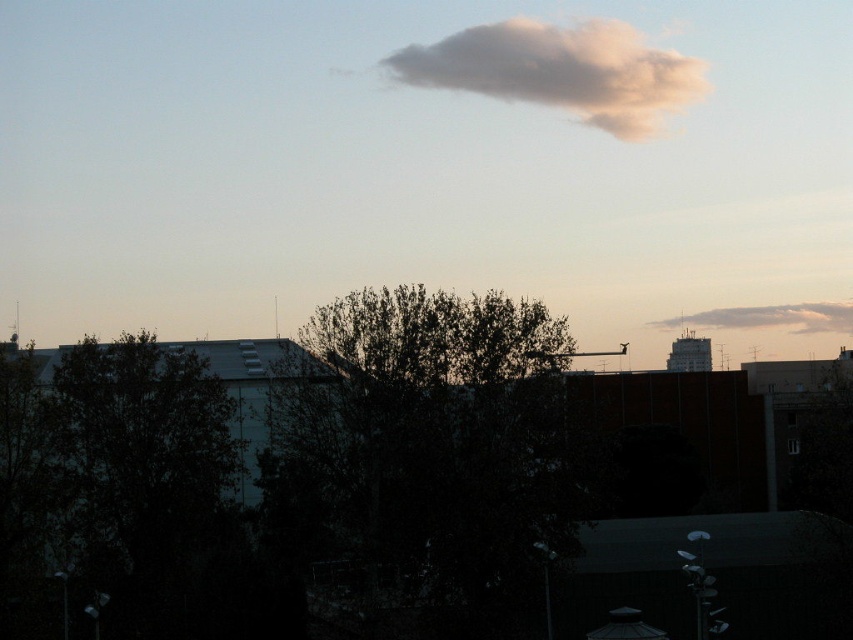
Question: Where is dark green leafy tree at center located in relation to white fluffy cloud at upper right in the image?

Choices:
 (A) below
 (B) above

Answer: (A)

Question: Which of these objects is positioned closest to the white fluffy cloud at upper center?

Choices:
 (A) dark green leafy tree at left
 (B) white fluffy cloud at upper right
 (C) dark green leafy tree at center

Answer: (B)

Question: Considering the real-world distances, which object is farthest from the dark green leafy tree at center?

Choices:
 (A) white fluffy cloud at upper right
 (B) dark green leafy tree at left
 (C) white fluffy cloud at upper center

Answer: (C)

Question: Does dark green leafy tree at center appear on the left side of white fluffy cloud at upper center?

Choices:
 (A) no
 (B) yes

Answer: (B)

Question: Which object is farther from the camera taking this photo?

Choices:
 (A) dark green leafy tree at center
 (B) dark green leafy tree at left
 (C) white fluffy cloud at upper center
 (D) white fluffy cloud at upper right

Answer: (C)

Question: Observing the image, what is the correct spatial positioning of dark green leafy tree at left in reference to white fluffy cloud at upper center?

Choices:
 (A) below
 (B) above

Answer: (A)